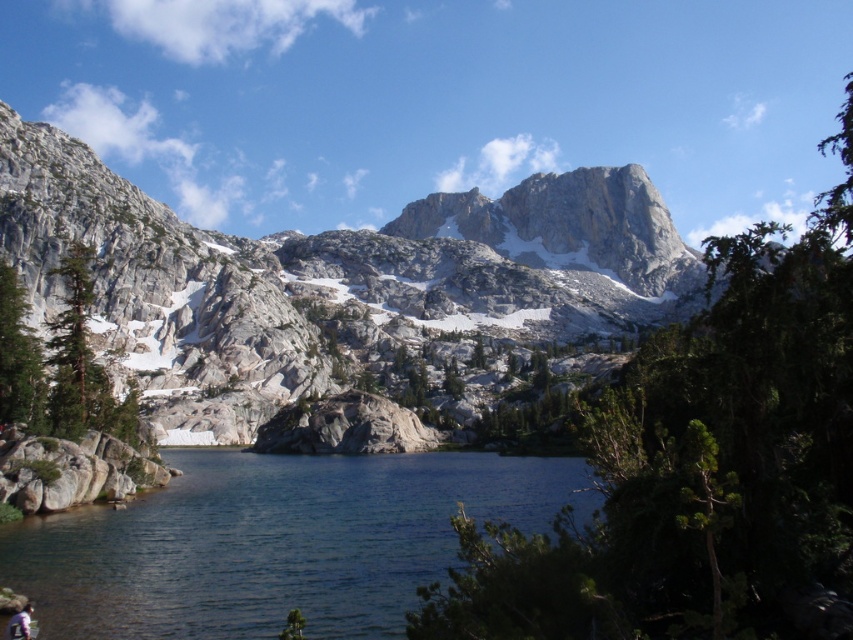
Between white rocky mountain at center and clear water at center, which one has more height?

With more height is white rocky mountain at center.

Consider the image. Is white rocky mountain at center wider than clear water at center?

Yes.

This screenshot has height=640, width=853. Describe the element at coordinates (332, 280) in the screenshot. I see `white rocky mountain at center` at that location.

Where is `white rocky mountain at center`? white rocky mountain at center is located at coordinates (332, 280).